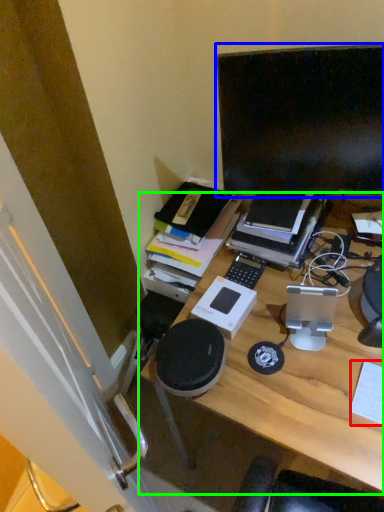
Question: Based on their relative distances, which object is nearer to computer keyboard (highlighted by a red box)? Choose from computer monitor (highlighted by a blue box) and desk (highlighted by a green box).

Choices:
 (A) computer monitor
 (B) desk

Answer: (B)